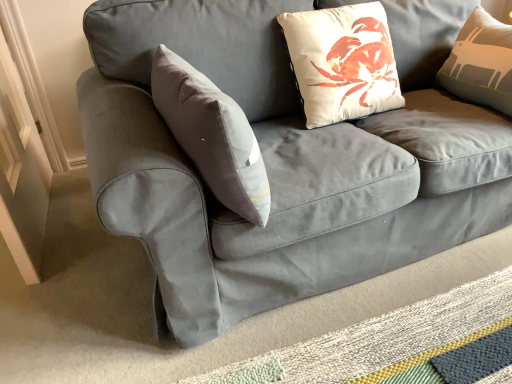
You are a GUI agent. You are given a task and a screenshot of the screen. Output one action in this format:
    pyautogui.click(x=<x>, y=<y>)
    Task: Click on the vacant area on top of textured woven mat at lower right (from a real-world perspective)
    The height and width of the screenshot is (384, 512).
    Given the screenshot: What is the action you would take?
    pyautogui.click(x=402, y=334)